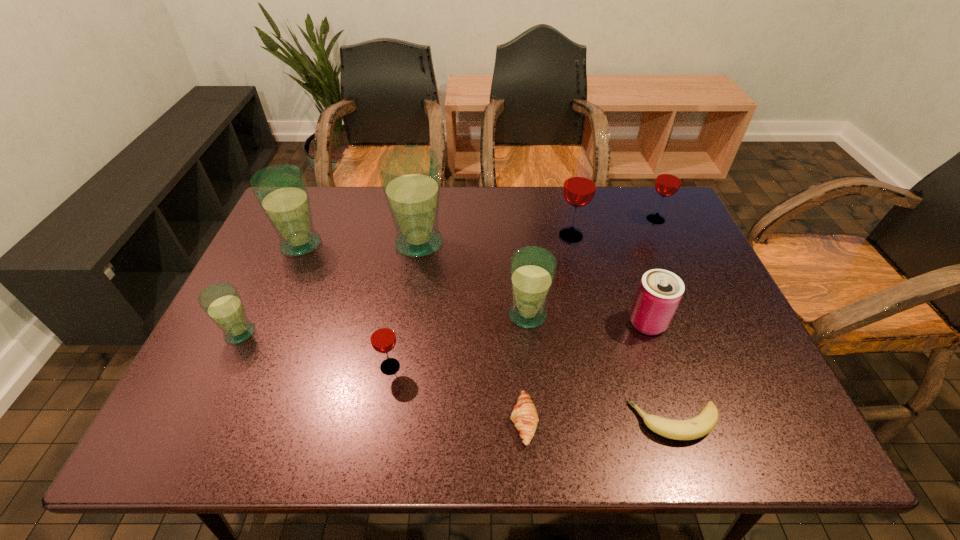
You are a GUI agent. You are given a task and a screenshot of the screen. Output one action in this format:
    pyautogui.click(x=<x>, y=<y>)
    Task: Click on the biggest blue glass
    
    Given the screenshot: What is the action you would take?
    pyautogui.click(x=410, y=175)

In order to click on the tallest glass in this screenshot , I will do `click(410, 175)`.

Where is `the second red glass from left to right`? the second red glass from left to right is located at coordinates (579, 188).

Where is `the second glass from right to left`? Image resolution: width=960 pixels, height=540 pixels. the second glass from right to left is located at coordinates (579, 188).

You are a GUI agent. You are given a task and a screenshot of the screen. Output one action in this format:
    pyautogui.click(x=<x>, y=<y>)
    Task: Click on the third smallest blue glass
    
    Given the screenshot: What is the action you would take?
    pyautogui.click(x=281, y=190)

Where is `the rightmost object`? The image size is (960, 540). the rightmost object is located at coordinates (668, 181).

Locate an element on the screen. This screenshot has height=540, width=960. the rightmost red glass is located at coordinates (668, 181).

The image size is (960, 540). What are the coordinates of `the third glass from right to left` in the screenshot? It's located at (533, 269).

Where is `the rightmost blue glass`? The height and width of the screenshot is (540, 960). the rightmost blue glass is located at coordinates (533, 269).

This screenshot has height=540, width=960. I want to click on pink can, so click(x=659, y=293).